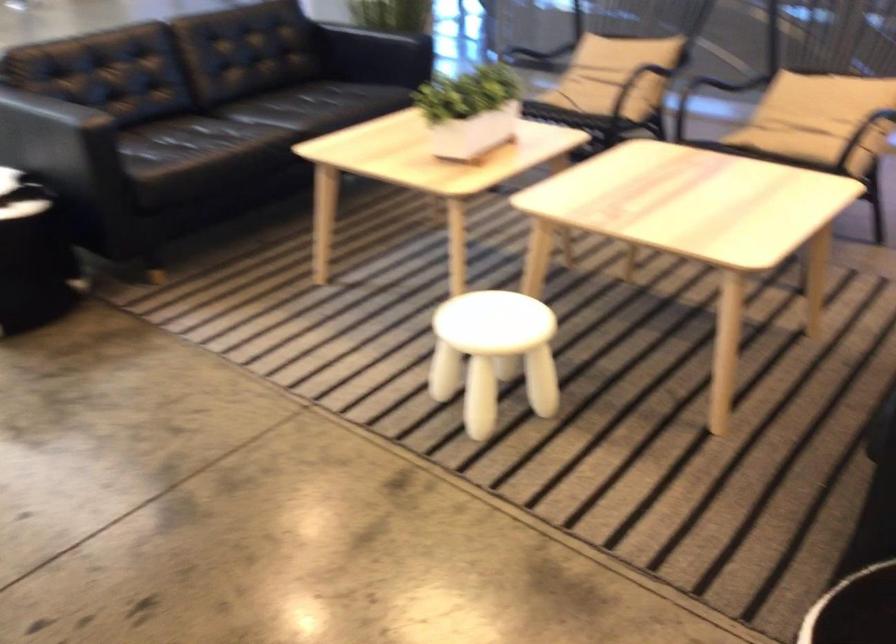
Find the location of a particular element. This screenshot has width=896, height=644. sofa sitting surface is located at coordinates (216, 140).